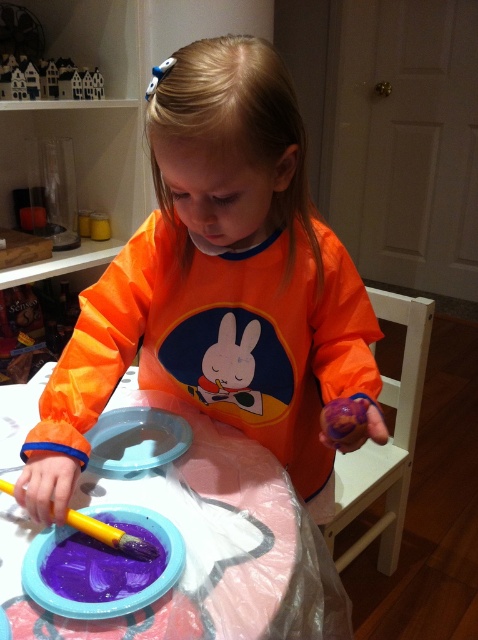
This screenshot has width=478, height=640. Describe the element at coordinates (112, 600) in the screenshot. I see `purple plastic plate at lower center` at that location.

This screenshot has height=640, width=478. Identify the location of purple plastic plate at lower center. (112, 600).

Who is positioned more to the left, wooden toy houses at upper left or purple rubber toy at lower center?

Positioned to the left is wooden toy houses at upper left.

Is wooden toy houses at upper left taller than purple rubber toy at lower center?

Yes, wooden toy houses at upper left is taller than purple rubber toy at lower center.

What do you see at coordinates (47, 80) in the screenshot?
I see `wooden toy houses at upper left` at bounding box center [47, 80].

Identify the location of wooden toy houses at upper left. (47, 80).

Can you confirm if orange matte shirt at center is taller than yellow plastic paint brush at lower left?

Correct, orange matte shirt at center is much taller as yellow plastic paint brush at lower left.

Does point (60, 470) come closer to viewer compared to point (90, 529)?

No, (60, 470) is behind (90, 529).

Locate an element on the screen. orange matte shirt at center is located at coordinates (218, 285).

This screenshot has height=640, width=478. Identify the location of orange matte shirt at center. (218, 285).